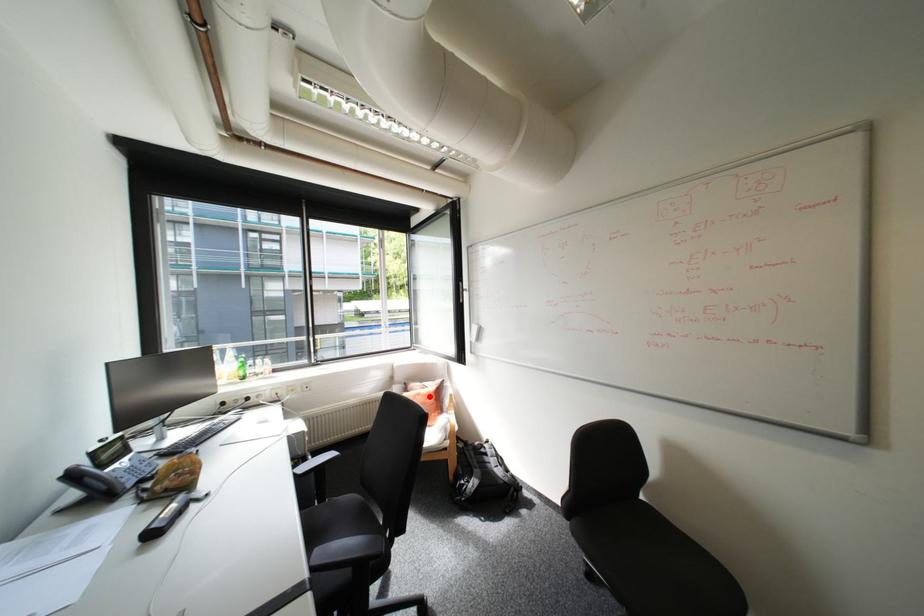
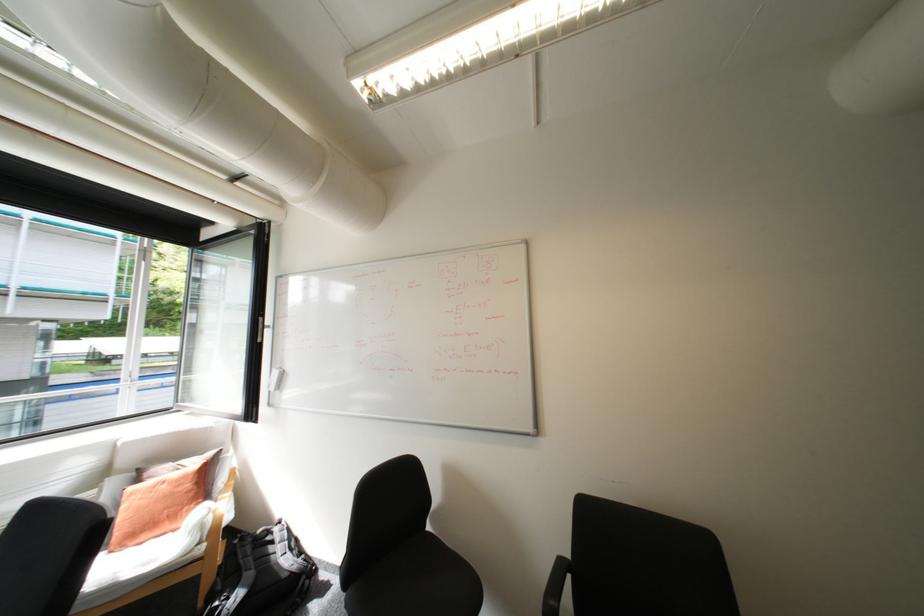
Question: I am providing you with two images of the same scene from different viewpoints. In image1, a red point is highlighted. Considering the same 3D point in image2, which of the following is correct?

Choices:
 (A) It is closer
 (B) It is farther

Answer: (A)